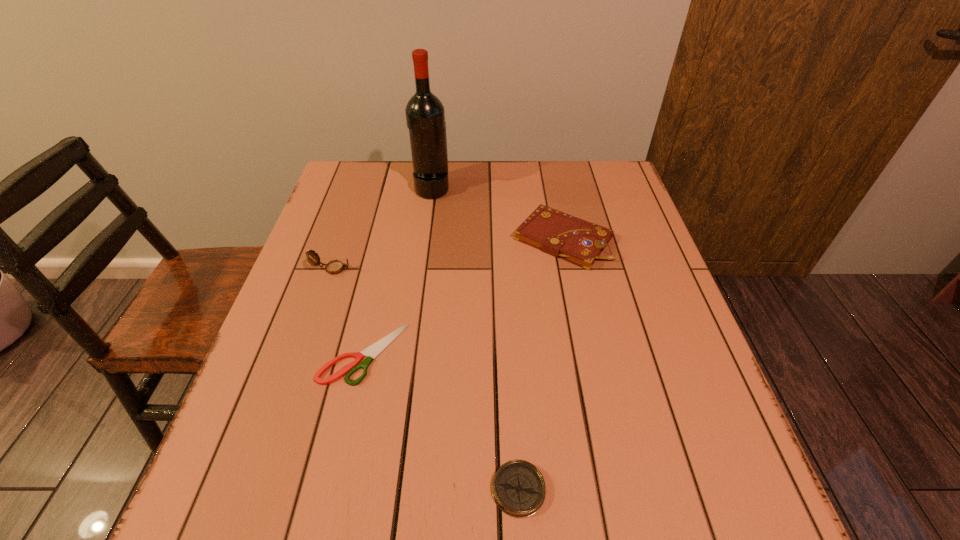
Locate an element on the screen. free space in the image that satisfies the following two spatial constraints: 1. on the front side of the right compass; 2. on the right side of the wine bottle is located at coordinates (392, 489).

The image size is (960, 540). I want to click on free location that satisfies the following two spatial constraints: 1. on the back side of the third tallest object; 2. on the left side of the right compass, so click(x=504, y=239).

Where is `vacant space that satisfies the following two spatial constraints: 1. on the face of the second nearest object; 2. on the right side of the second tallest object`? This screenshot has width=960, height=540. vacant space that satisfies the following two spatial constraints: 1. on the face of the second nearest object; 2. on the right side of the second tallest object is located at coordinates (303, 354).